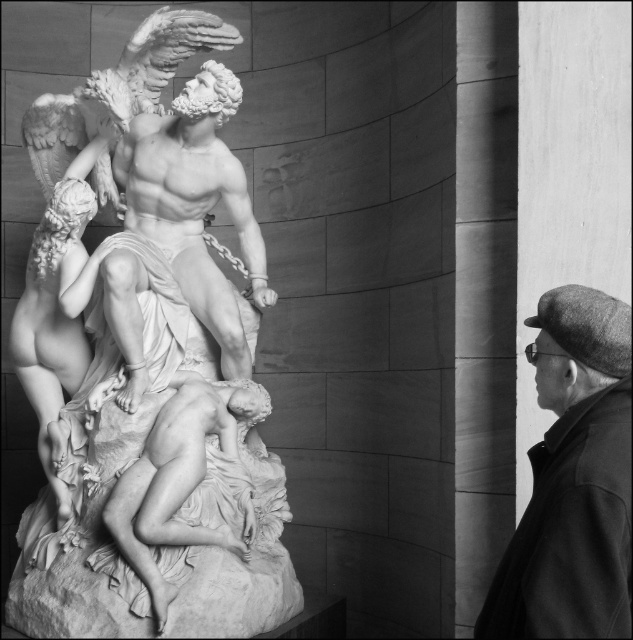
Is white marble statue at center to the right of white marble reclining figure at center from the viewer's perspective?

No, white marble statue at center is not to the right of white marble reclining figure at center.

Can you confirm if white marble statue at center is positioned above white marble reclining figure at center?

Correct, white marble statue at center is located above white marble reclining figure at center.

Where is `white marble statue at center`? This screenshot has height=640, width=633. white marble statue at center is located at coordinates (194, 204).

Where is `white marble sculpture at center`? The height and width of the screenshot is (640, 633). white marble sculpture at center is located at coordinates (147, 365).

Who is positioned more to the left, white marble sculpture at center or white marble reclining figure at center?

Positioned to the left is white marble sculpture at center.

At what (x,y) coordinates should I click in order to perform the action: click on white marble sculpture at center. Please return your answer as a coordinate pair (x, y). The image size is (633, 640). Looking at the image, I should click on (147, 365).

Is dark gray woolen cap at upper right taller than white marble statue at center?

No, dark gray woolen cap at upper right is not taller than white marble statue at center.

This screenshot has width=633, height=640. I want to click on dark gray woolen cap at upper right, so click(x=572, y=481).

Between point (546, 460) and point (141, 376), which one is positioned behind?

Point (141, 376)

The height and width of the screenshot is (640, 633). Find the location of `dark gray woolen cap at upper right`. dark gray woolen cap at upper right is located at coordinates (572, 481).